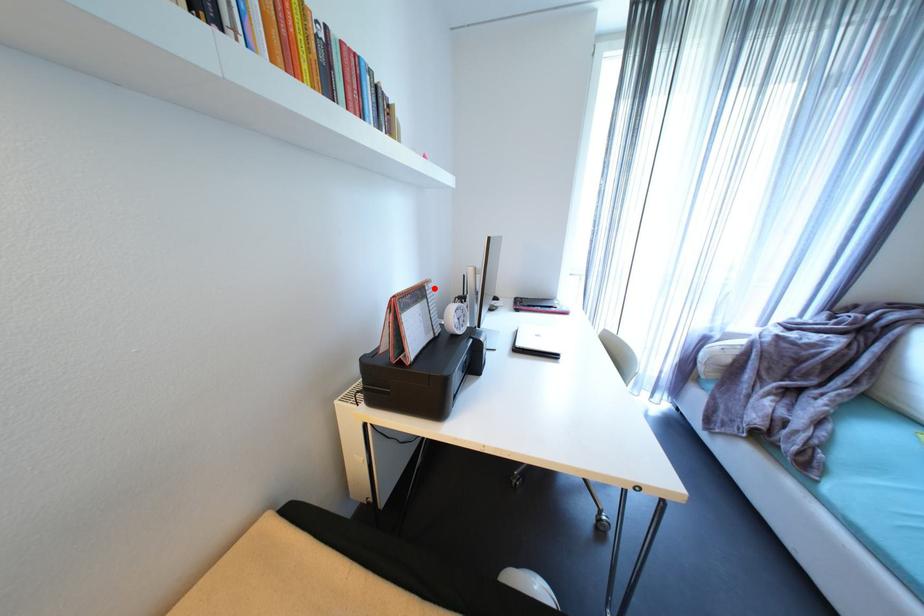
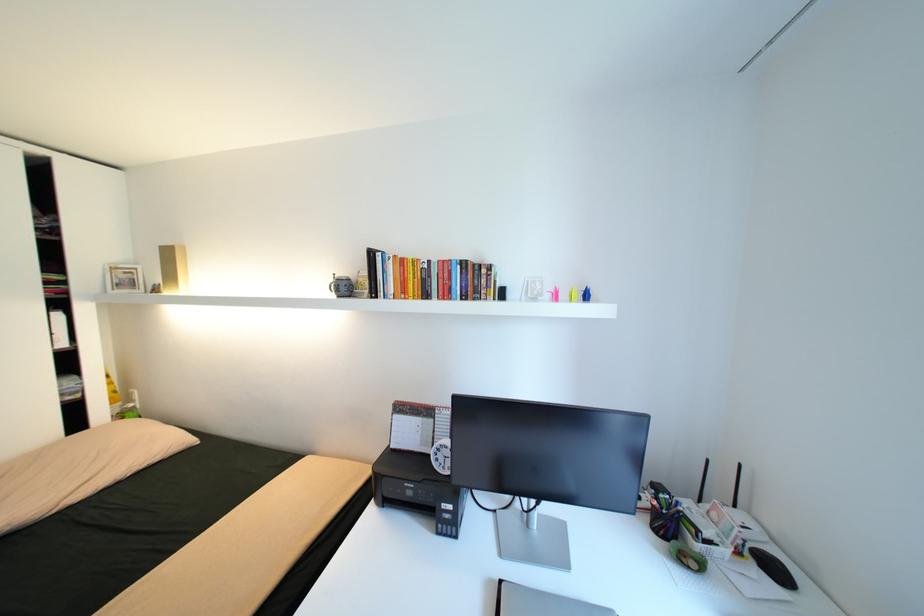
Question: I am providing you with two images of the same scene from different viewpoints. Image1 has a red point marked. In image2, the corresponding 3D location appears at what relative position? Reply with the corresponding letter.

Choices:
 (A) Closer
 (B) Farther

Answer: (B)